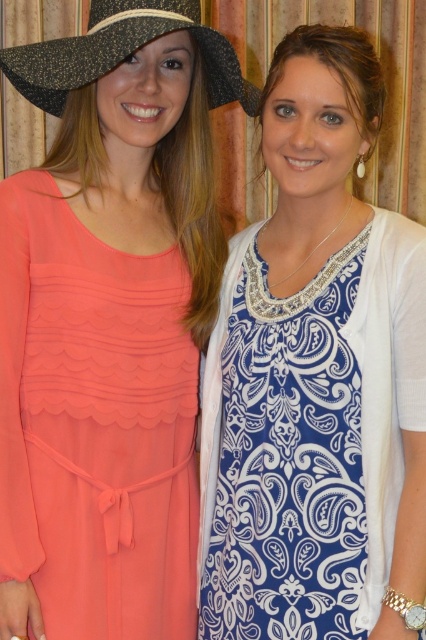
You are a photographer adjusting your camera settings to focus on two specific points in the image. The points are labeled as point (311,29) and point (120,17). Which point is closer to your camera lens?

Point (311,29) is further to the camera than point (120,17), so the closer point to the camera lens is point (120,17).

You are planning to wear either the blue printed dress at center or the coral chiffon dress at left to a party. If you want to choose the wider one, which dress should you pick?

The blue printed dress at center is wider than the coral chiffon dress at left, so you should pick the blue printed dress at center.

You are a photographer setting up a shoot in a room with a patterned curtain background. You notice two dresses displayed in the scene. The blue printed dress at center and the coral chiffon dress at left. Which dress is more visible to the camera positioned at the front of the room?

The blue printed dress at center is more visible to the camera because it is in front of the coral chiffon dress at left, making it closer to the camera and thus more prominently visible.